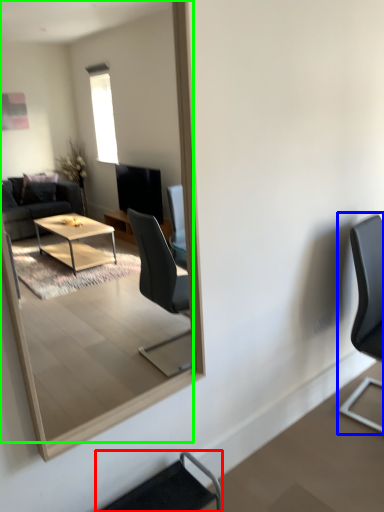
Question: Which is farther away from chair (highlighted by a red box)? chair (highlighted by a blue box) or mirror (highlighted by a green box)?

Choices:
 (A) chair
 (B) mirror

Answer: (B)